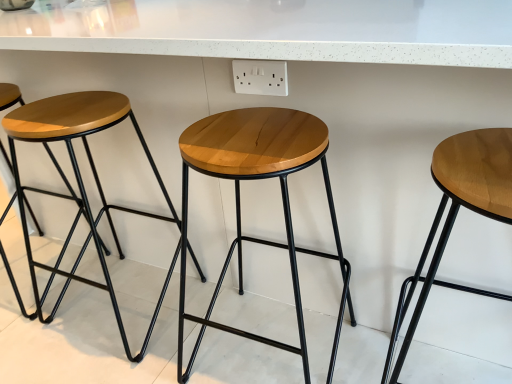
Where is `free space above wooden stool at left, which is the 2th stool from left to right (from a real-world perspective)`? The image size is (512, 384). free space above wooden stool at left, which is the 2th stool from left to right (from a real-world perspective) is located at coordinates (67, 109).